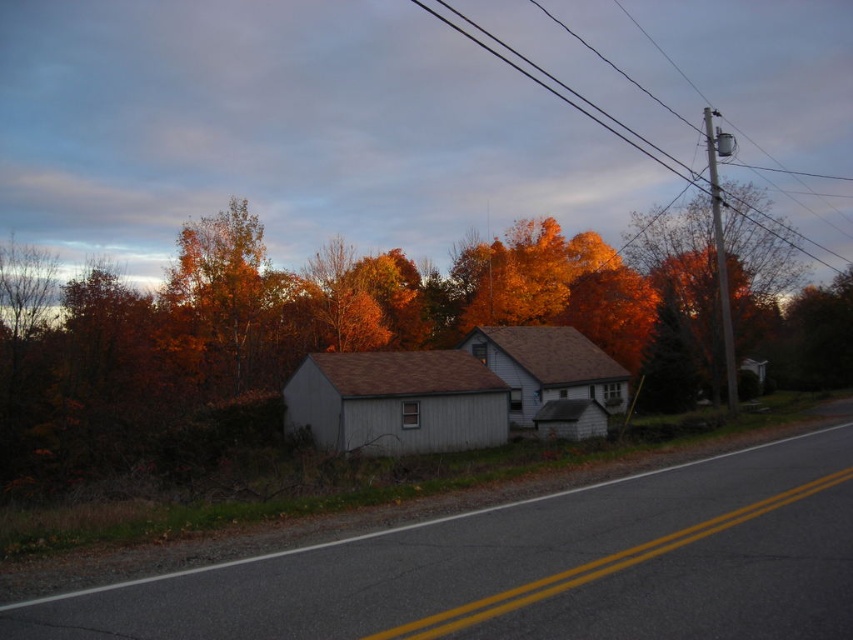
Question: Can you confirm if orange leaves at center is bigger than metallic wire at upper center?

Choices:
 (A) no
 (B) yes

Answer: (A)

Question: Among these objects, which one is nearest to the camera?

Choices:
 (A) orange leaves at center
 (B) metallic wire at upper center

Answer: (A)

Question: Can you confirm if orange leaves at center is positioned above metallic wire at upper center?

Choices:
 (A) yes
 (B) no

Answer: (B)

Question: Which point is closer to the camera taking this photo?

Choices:
 (A) click(752, 221)
 (B) click(30, 422)

Answer: (B)

Question: Can you confirm if orange leaves at center is bigger than metallic wire at upper center?

Choices:
 (A) yes
 (B) no

Answer: (B)

Question: Which point appears closest to the camera in this image?

Choices:
 (A) (440, 348)
 (B) (798, 246)

Answer: (B)